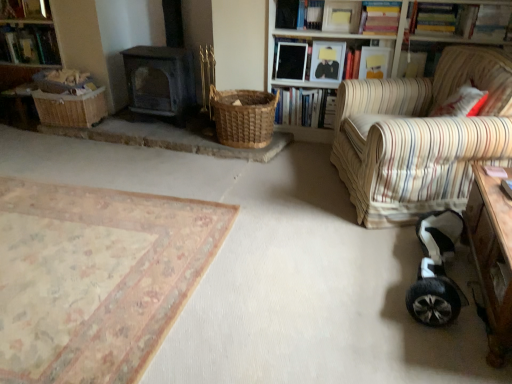
Question: Looking at their shapes, would you say white paper book at upper center, the 2th book when ordered from right to left, is wider or thinner than beige floral rug at lower left?

Choices:
 (A) wide
 (B) thin

Answer: (B)

Question: Considering their positions, is white paper book at upper center, positioned as the 9th book in left-to-right order, located in front of or behind beige floral rug at lower left?

Choices:
 (A) front
 (B) behind

Answer: (B)

Question: Estimate the real-world distances between objects in this image. Which object is farther from the wooden frame at upper center, arranged as the 6th book when viewed from the left?

Choices:
 (A) wooden bookshelf at upper right
 (B) beige floral rug at lower left
 (C) hardcover books at upper center, acting as the seventh book starting from the right
 (D) hardcover book at upper right, marked as the 4th book in a right-to-left arrangement
 (E) white paper book at upper center, the 2th book when ordered from right to left

Answer: (B)

Question: Considering the real-world distances, which object is closest to the hardcover book at upper left, the first book in the left-to-right sequence?

Choices:
 (A) striped fabric armchair at right
 (B) wooden frame at upper center, placed as the 5th book when sorted from right to left
 (C) beige floral rug at lower left
 (D) woven brown basket at center, placed as the first basket when sorted from right to left
 (E) wooden desk at lower right

Answer: (D)